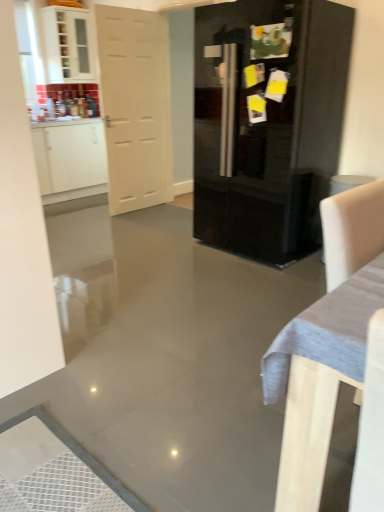
Question: Considering the relative positions of white glossy cabinet at upper left, positioned as the 1th cabinetry in top-to-bottom order, and white fabric armchair at right in the image provided, is white glossy cabinet at upper left, positioned as the 1th cabinetry in top-to-bottom order, to the right of white fabric armchair at right from the viewer's perspective?

Choices:
 (A) yes
 (B) no

Answer: (B)

Question: Is white glossy cabinet at upper left, positioned as the 1th cabinetry in top-to-bottom order, positioned far away from white fabric armchair at right?

Choices:
 (A) no
 (B) yes

Answer: (B)

Question: Considering the relative sizes of white glossy cabinet at upper left, positioned as the second cabinetry in bottom-to-top order, and white fabric armchair at right in the image provided, is white glossy cabinet at upper left, positioned as the second cabinetry in bottom-to-top order, thinner than white fabric armchair at right?

Choices:
 (A) no
 (B) yes

Answer: (B)

Question: Can you confirm if white glossy cabinet at upper left, positioned as the second cabinetry in bottom-to-top order, is smaller than white fabric armchair at right?

Choices:
 (A) yes
 (B) no

Answer: (B)

Question: Is white glossy cabinet at upper left, positioned as the 1th cabinetry in top-to-bottom order, outside white fabric armchair at right?

Choices:
 (A) yes
 (B) no

Answer: (A)

Question: Is white glossy cabinet at upper left, positioned as the second cabinetry in bottom-to-top order, facing towards white fabric armchair at right?

Choices:
 (A) yes
 (B) no

Answer: (A)

Question: Is glossy black refrigerator at center at the left side of white glossy cabinet at upper left, the 1th cabinetry positioned from the bottom?

Choices:
 (A) yes
 (B) no

Answer: (B)

Question: Can you confirm if glossy black refrigerator at center is bigger than white glossy cabinet at upper left, marked as the second cabinetry in a top-to-bottom arrangement?

Choices:
 (A) no
 (B) yes

Answer: (B)

Question: Is glossy black refrigerator at center facing away from white glossy cabinet at upper left, marked as the second cabinetry in a top-to-bottom arrangement?

Choices:
 (A) yes
 (B) no

Answer: (B)

Question: From a real-world perspective, is glossy black refrigerator at center beneath white glossy cabinet at upper left, marked as the second cabinetry in a top-to-bottom arrangement?

Choices:
 (A) yes
 (B) no

Answer: (B)

Question: Can you confirm if glossy black refrigerator at center is shorter than white glossy cabinet at upper left, marked as the second cabinetry in a top-to-bottom arrangement?

Choices:
 (A) yes
 (B) no

Answer: (B)

Question: Does glossy black refrigerator at center lie in front of white glossy cabinet at upper left, marked as the second cabinetry in a top-to-bottom arrangement?

Choices:
 (A) no
 (B) yes

Answer: (B)

Question: Is glossy black refrigerator at center closer to camera compared to white matte door at left?

Choices:
 (A) no
 (B) yes

Answer: (B)